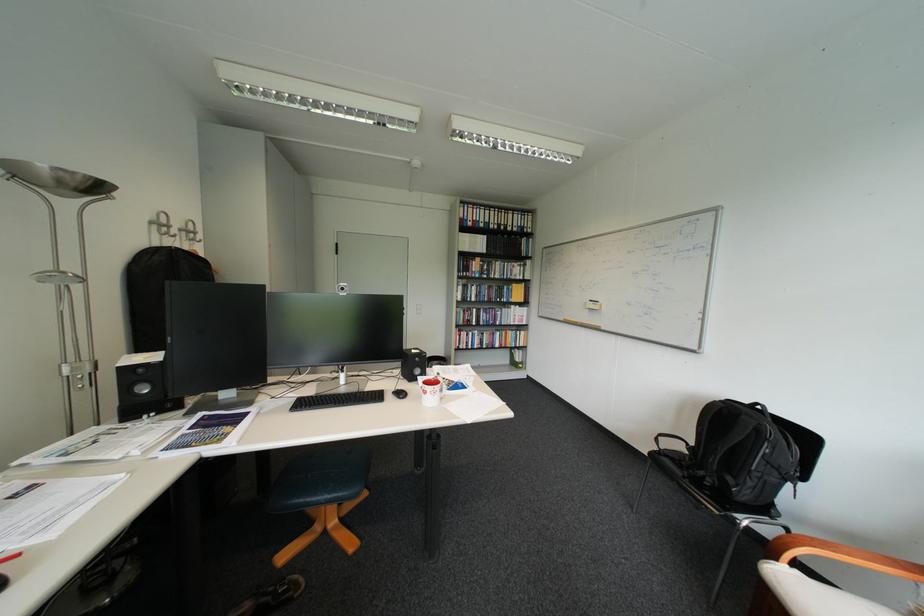
Where is `wooden chair armrest`? This screenshot has width=924, height=616. wooden chair armrest is located at coordinates (841, 554).